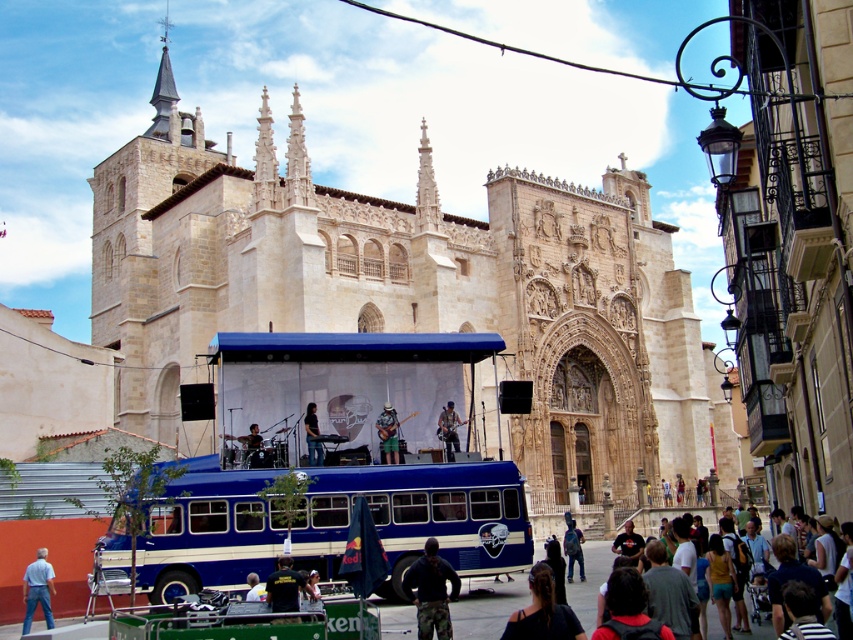
You are a photographer standing in front of the grand historic building. You notice a matte brown guitar at center and denim pants at center. Which object is positioned to the right when viewed from your perspective?

The matte brown guitar at center is positioned to the right of the denim pants at center.

You are a photographer standing at the back of the crowd in front of the historic building. You want to take a photo of the dark brown leather jacket at lower center and camouflage pants at lower center. Since your camera has a minimum focus distance of 5 meters, will you be able to capture both subjects clearly in one shot?

The distance between the dark brown leather jacket at lower center and camouflage pants at lower center is 6.82 meters. Since your camera requires at least 5 meters to focus, you can capture both subjects clearly as the distance is sufficient.